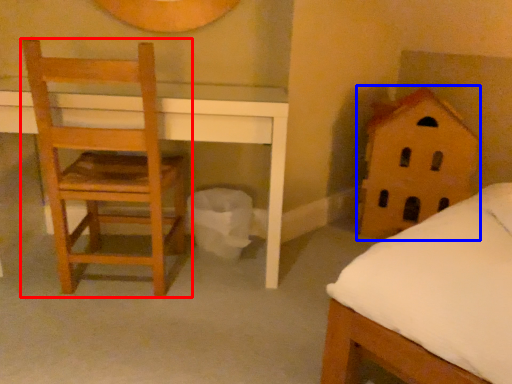
Question: Which of the following is the closest to the observer, chair (highlighted by a red box) or toy (highlighted by a blue box)?

Choices:
 (A) chair
 (B) toy

Answer: (A)